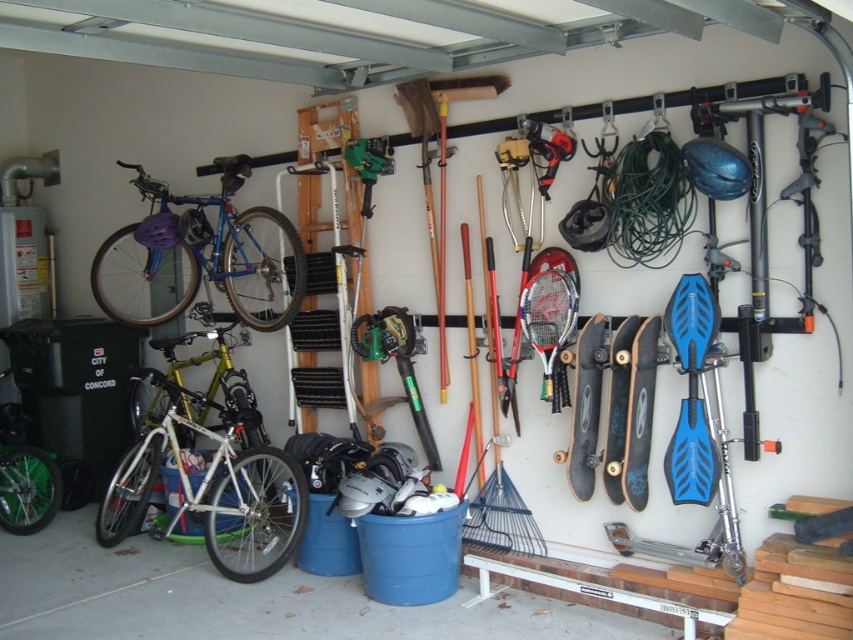
Is blue matte bicycle at upper left bigger than green plastic chainsaw at center?

Indeed, blue matte bicycle at upper left has a larger size compared to green plastic chainsaw at center.

Who is higher up, blue matte bicycle at upper left or green plastic chainsaw at center?

Positioned higher is blue matte bicycle at upper left.

Is point (259, 257) closer to camera compared to point (354, 352)?

No, it is not.

Locate an element on the screen. The image size is (853, 640). blue matte bicycle at upper left is located at coordinates tap(199, 260).

Between point (228, 440) and point (364, 353), which one is positioned behind?

The point (228, 440) is behind.

Does white matte bicycle at left have a lesser height compared to green plastic chainsaw at center?

No.

Is point (198, 397) closer to camera compared to point (401, 364)?

No, (198, 397) is further to viewer.

Identify the location of white matte bicycle at left. The image size is (853, 640). (212, 484).

Is white matte bicycle at left in front of blue matte bicycle at upper left?

Yes.

Who is positioned more to the left, white matte bicycle at left or blue matte bicycle at upper left?

Positioned to the left is blue matte bicycle at upper left.

Is point (96, 534) in front of point (115, 236)?

Yes.

Identify the location of white matte bicycle at left. (212, 484).